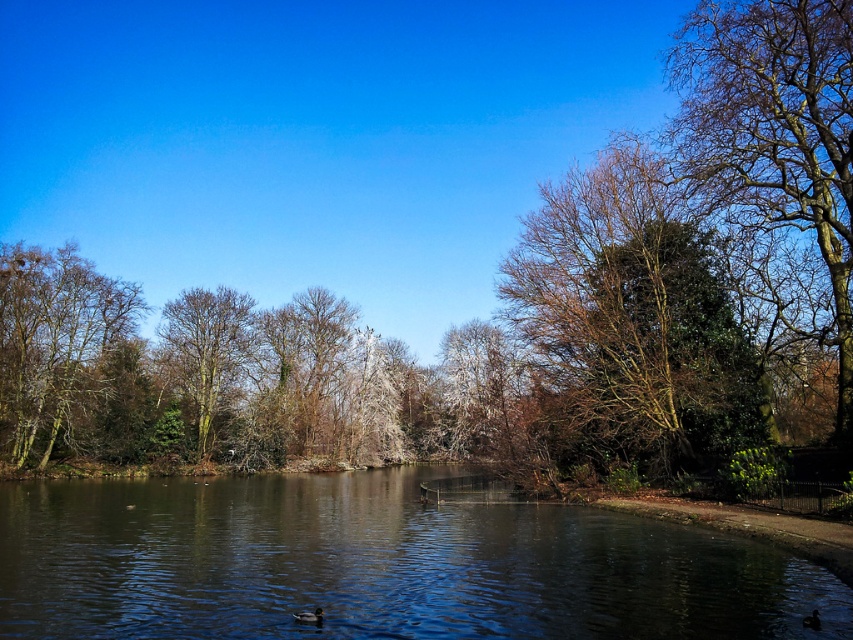
Who is lower down, bare branches at left or smooth bark tree at center?

smooth bark tree at center

Does bare branches at left have a larger size compared to smooth bark tree at center?

No, bare branches at left is not bigger than smooth bark tree at center.

Based on the photo, who is more forward, (45, 356) or (514, 371)?

Point (514, 371) is in front.

This screenshot has height=640, width=853. What are the coordinates of `bare branches at left` in the screenshot? It's located at (54, 342).

Looking at this image, who is positioned more to the left, smooth reflective water at center or bare branches at upper right?

smooth reflective water at center

Who is taller, smooth reflective water at center or bare branches at upper right?

Standing taller between the two is bare branches at upper right.

From the picture: Who is more forward, (201, 500) or (689, 157)?

Point (689, 157)

This screenshot has width=853, height=640. Find the location of `smooth reflective water at center`. smooth reflective water at center is located at coordinates (381, 563).

Between smooth reflective water at center and bare branches tree at right, which one has less height?

Standing shorter between the two is smooth reflective water at center.

Describe the element at coordinates (381, 563) in the screenshot. The height and width of the screenshot is (640, 853). I see `smooth reflective water at center` at that location.

Does point (399, 624) come closer to viewer compared to point (614, 364)?

Yes, it is in front of point (614, 364).

The height and width of the screenshot is (640, 853). What are the coordinates of `smooth reflective water at center` in the screenshot? It's located at (381, 563).